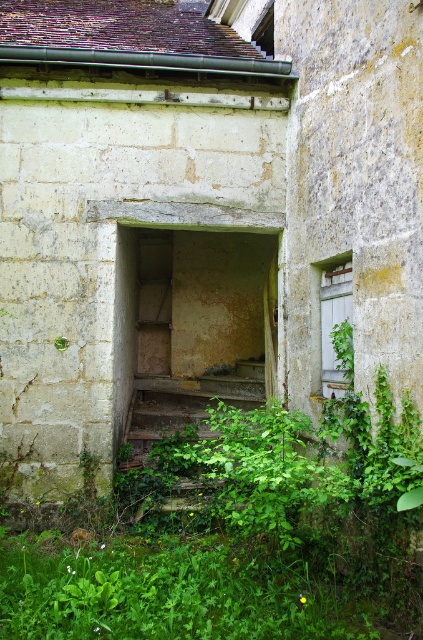
You are a visitor approaching the old stone building and want to enter through the doorway. You see a green leafy plant at lower center and wooden rustic stairs at center. Which object is closer to you as you approach the building?

The green leafy plant at lower center is closer to you because it is in front of the wooden rustic stairs at center, meaning it is positioned nearer to the entrance.

You are a delivery person trying to enter the building through the doorway. There is a green leafy plant at lower center and wooden rustic stairs at center in your way. Which object is blocking your path more to the right?

The green leafy plant at lower center is positioned on the right side of wooden rustic stairs at center, so it is blocking the path more to the right.

You are a visitor approaching the old stone building and want to enter through the doorway. There is a green leafy plant at lower center and wooden rustic stairs at center in your path. Which object should you move around first to reach the entrance?

You should move around the green leafy plant at lower center first because it is located below the wooden rustic stairs at center, meaning it is closer to your current position and must be navigated before the stairs.